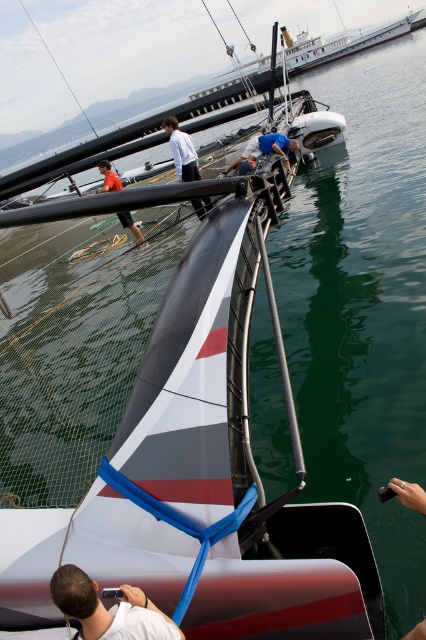
Between blue fabric shirt at center and orange fabric shorts at lower left, which one is positioned lower?

Positioned lower is orange fabric shorts at lower left.

Is blue fabric shirt at center further to the viewer compared to orange fabric shorts at lower left?

No, it is not.

Find the location of a particular element. blue fabric shirt at center is located at coordinates (264, 150).

Locate an element on the screen. The width and height of the screenshot is (426, 640). white matte camera at lower left is located at coordinates (108, 611).

Is white matte camera at lower left positioned at the back of orange fabric shorts at lower left?

No, it is in front of orange fabric shorts at lower left.

The width and height of the screenshot is (426, 640). I want to click on white matte camera at lower left, so click(x=108, y=611).

Between white matte shirt at center and orange fabric shorts at lower left, which one appears on the right side from the viewer's perspective?

From the viewer's perspective, white matte shirt at center appears more on the right side.

Does point (178, 129) come farther from viewer compared to point (108, 189)?

No, (178, 129) is closer to viewer.

Locate an element on the screen. This screenshot has width=426, height=640. white matte shirt at center is located at coordinates (181, 150).